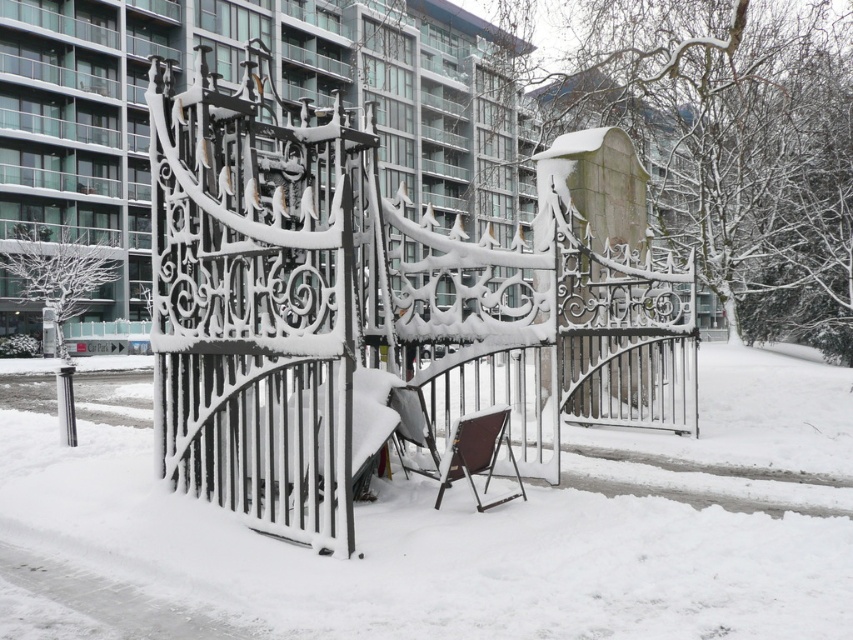
You are a delivery person trying to navigate through the snow to reach the building behind the gates. The white matte snow at center is in your path. Given that your delivery cart is 2 meters wide, can you pass through the gap between the gates without the cart getting stuck?

The gap between the gates is 4.21 meters wide, which is wider than the delivery cart that is 2 meters wide. Therefore, you can pass through the gap between the gates without the cart getting stuck.

You are standing in front of the snow covered wrought iron gates and want to sit down. There is a white matte snow at center and a brown fabric chair at center. Which one is closer to you so you can sit comfortably?

The white matte snow at center is closer to the viewer than the brown fabric chair at center, so you can sit on the snow closer to you.